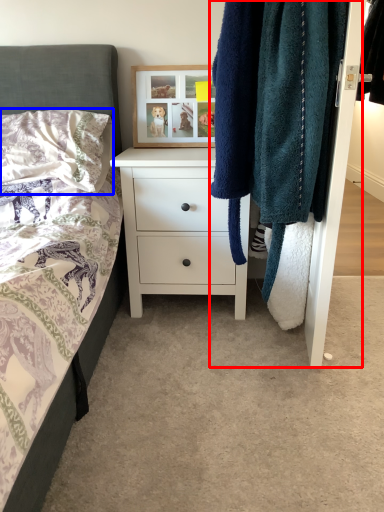
Question: Which object appears closest to the camera in this image, closet (highlighted by a red box) or pillow (highlighted by a blue box)?

Choices:
 (A) closet
 (B) pillow

Answer: (A)